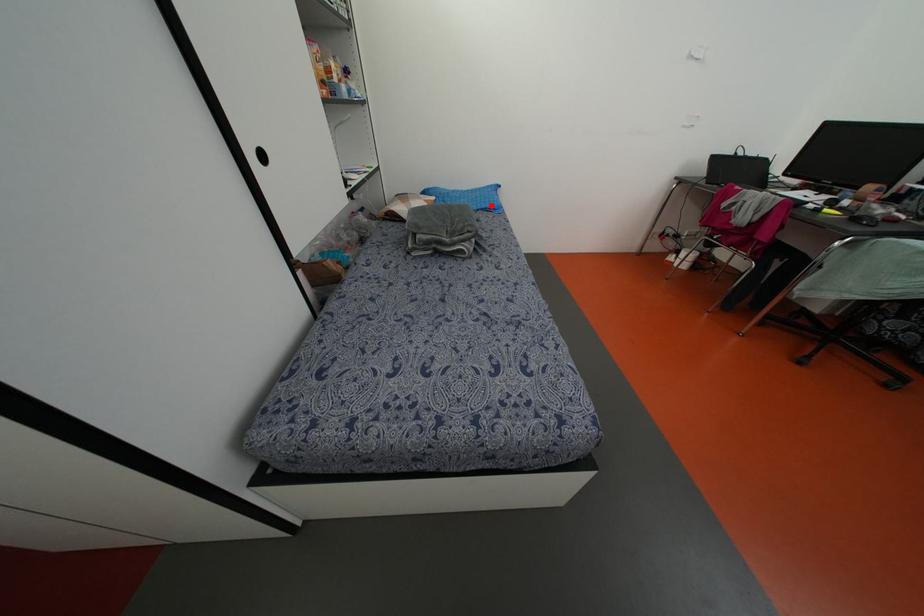
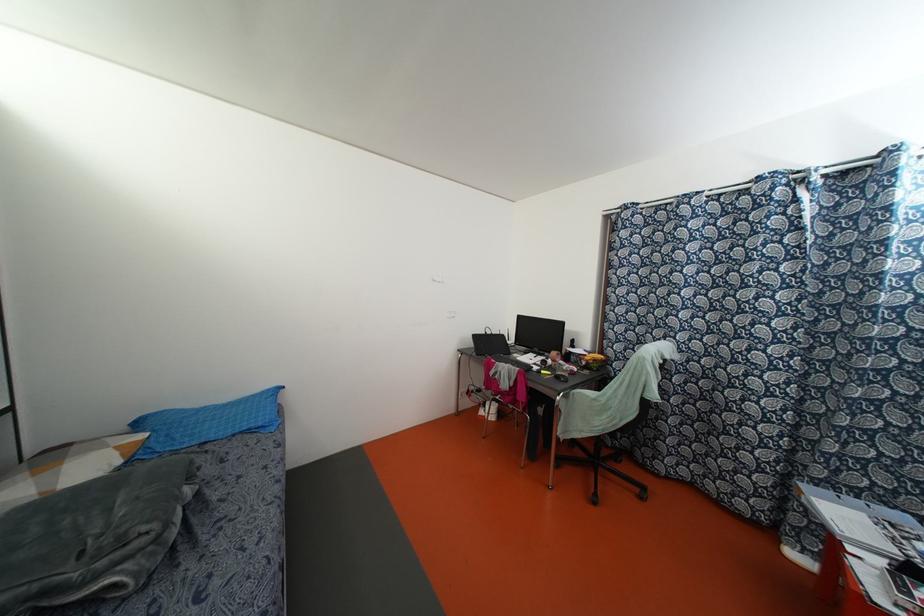
Question: I am providing you with two images of the same scene from different viewpoints. In image1, a red point is highlighted. Considering the same 3D point in image2, which of the following is correct?

Choices:
 (A) It is closer
 (B) It is farther

Answer: (A)